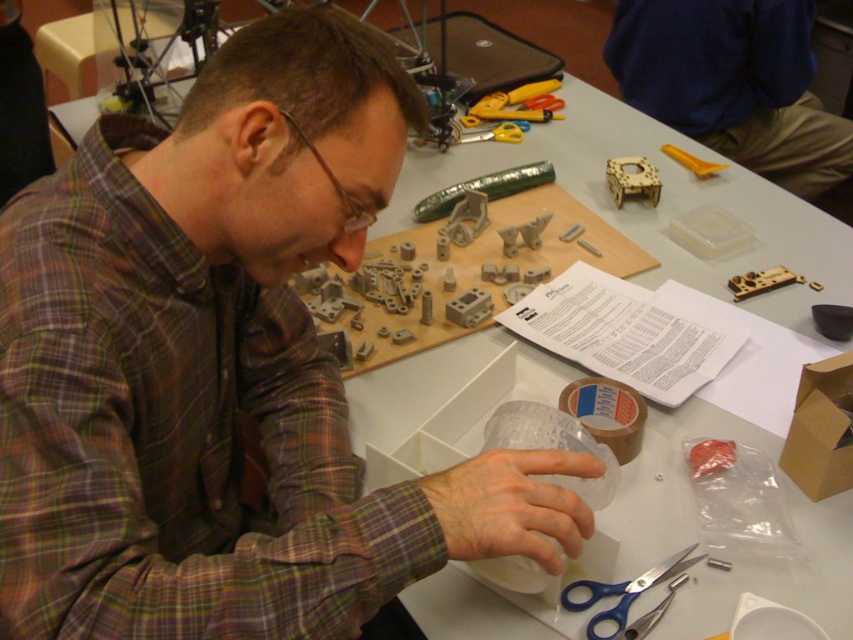
Question: Which of the following is the closest to the observer?

Choices:
 (A) yellow plastic screwdriver at upper right
 (B) wooden puzzle piece at upper right
 (C) blue plastic scissors at lower center

Answer: (C)

Question: Is blue plastic scissors at lower center positioned before metallic gold gear at upper right?

Choices:
 (A) no
 (B) yes

Answer: (B)

Question: Does blue plastic scissors at lower center have a greater width compared to metallic gold gear at upper right?

Choices:
 (A) yes
 (B) no

Answer: (A)

Question: Is matte plastic cup at center to the right of blue plastic scissors at lower center from the viewer's perspective?

Choices:
 (A) no
 (B) yes

Answer: (A)

Question: Which object is farther from the camera taking this photo?

Choices:
 (A) metallic gold gear at upper right
 (B) matte plastic cup at center
 (C) yellow plastic screwdriver at upper right
 (D) wooden puzzle piece at upper right

Answer: (D)

Question: Which point is farther from the camera taking this photo?

Choices:
 (A) (764, 38)
 (B) (384, 570)
 (C) (730, 282)
 (D) (676, 154)

Answer: (A)